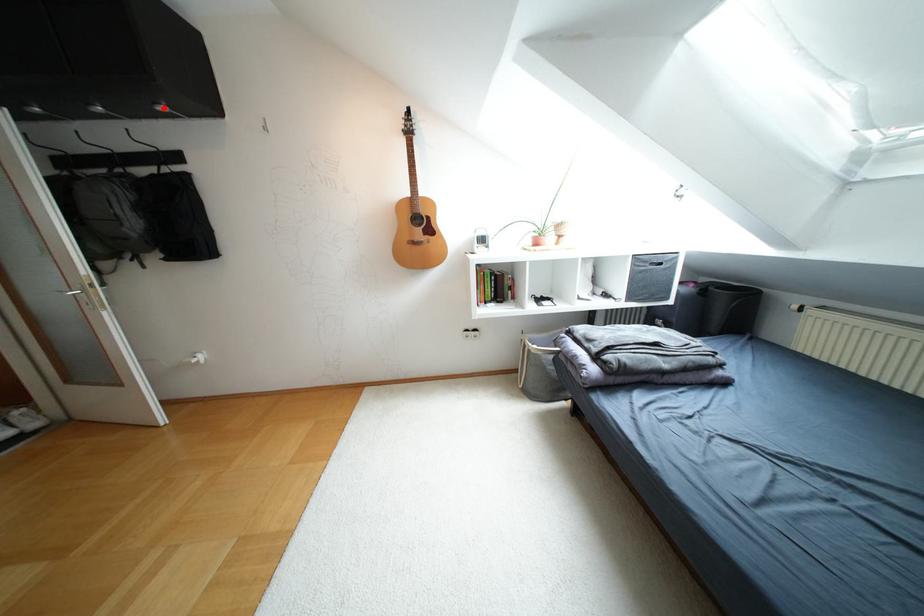
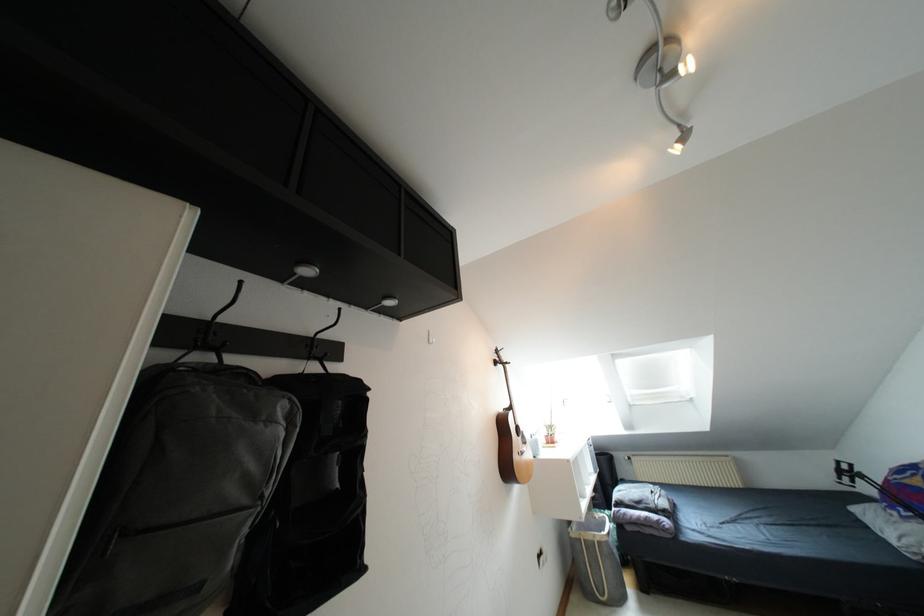
Find the pixel in the second image that matches the highlighted location in the first image.

(388, 302)